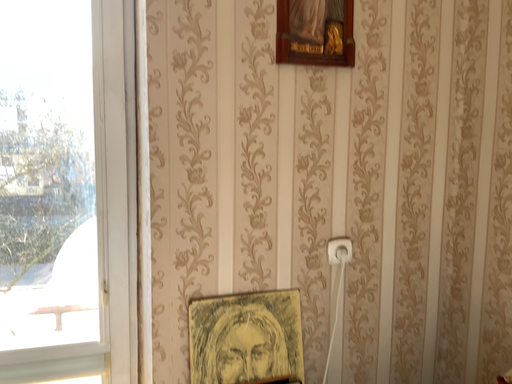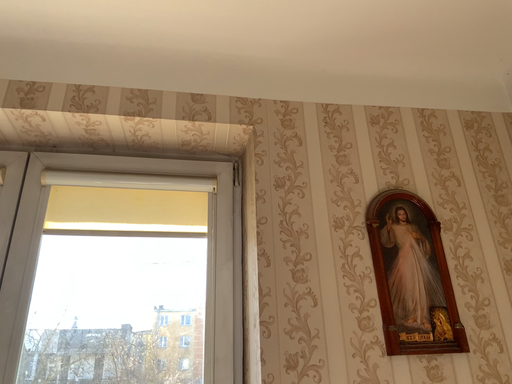
Question: How did the camera likely rotate when shooting the video?

Choices:
 (A) rotated upward
 (B) rotated downward

Answer: (A)